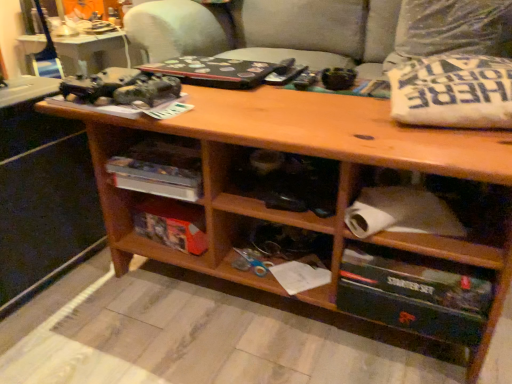
Question: Could black cardboard starter set at lower right be considered to be inside white fabric pillow at upper right, the first pillow in the back-to-front sequence?

Choices:
 (A) no
 (B) yes

Answer: (A)

Question: Considering the relative positions of white fabric pillow at upper right, acting as the first pillow starting from the top, and black cardboard starter set at lower right in the image provided, is white fabric pillow at upper right, acting as the first pillow starting from the top, behind black cardboard starter set at lower right?

Choices:
 (A) no
 (B) yes

Answer: (B)

Question: Does white fabric pillow at upper right, acting as the first pillow starting from the top, have a greater width compared to black cardboard starter set at lower right?

Choices:
 (A) yes
 (B) no

Answer: (B)

Question: Is white fabric pillow at upper right, the first pillow in the back-to-front sequence, oriented towards black cardboard starter set at lower right?

Choices:
 (A) no
 (B) yes

Answer: (B)

Question: Is white fabric pillow at upper right, placed as the second pillow when sorted from bottom to top, at the right side of black cardboard starter set at lower right?

Choices:
 (A) yes
 (B) no

Answer: (A)

Question: Are white fabric pillow at upper right, the first pillow in the back-to-front sequence, and black cardboard starter set at lower right far apart?

Choices:
 (A) no
 (B) yes

Answer: (B)

Question: Is wooden shelf at center not close to black cardboard starter set at lower right?

Choices:
 (A) no
 (B) yes

Answer: (A)

Question: Is wooden shelf at center bigger than black cardboard starter set at lower right?

Choices:
 (A) no
 (B) yes

Answer: (A)

Question: From the image's perspective, is wooden shelf at center located beneath black cardboard starter set at lower right?

Choices:
 (A) yes
 (B) no

Answer: (B)

Question: Considering the relative positions of wooden shelf at center and black cardboard starter set at lower right in the image provided, is wooden shelf at center to the right of black cardboard starter set at lower right from the viewer's perspective?

Choices:
 (A) no
 (B) yes

Answer: (A)

Question: Is the position of wooden shelf at center more distant than that of black cardboard starter set at lower right?

Choices:
 (A) no
 (B) yes

Answer: (B)

Question: From the image's perspective, is wooden shelf at center located above black cardboard starter set at lower right?

Choices:
 (A) no
 (B) yes

Answer: (B)

Question: From the image's perspective, is orange cardboard box at center on top of black cardboard starter set at lower right?

Choices:
 (A) no
 (B) yes

Answer: (B)